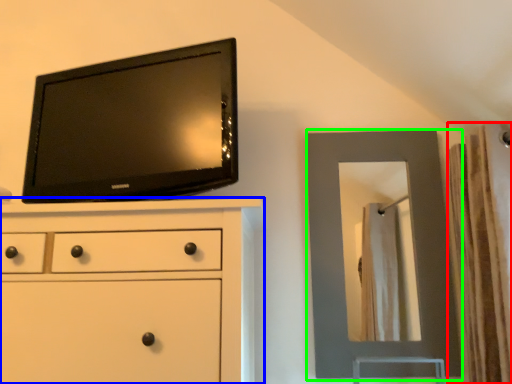
Question: Which object is positioned farthest from curtain (highlighted by a red box)? Select from chest of drawers (highlighted by a blue box) and mirror (highlighted by a green box).

Choices:
 (A) chest of drawers
 (B) mirror

Answer: (A)